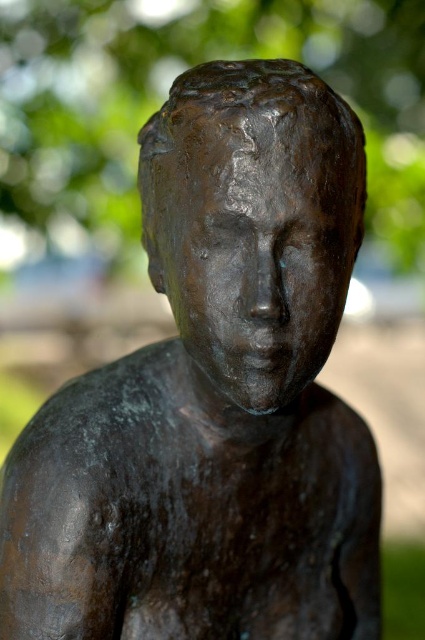
Question: In this image, where is green matte tree at center located relative to bronze statue at center?

Choices:
 (A) left
 (B) right

Answer: (A)

Question: Which point is closer to the camera taking this photo?

Choices:
 (A) (85, 96)
 (B) (167, 205)

Answer: (B)

Question: Which point is closer to the camera?

Choices:
 (A) green matte tree at center
 (B) bronze statue at center

Answer: (B)

Question: Can you confirm if green matte tree at center is thinner than bronze statue at center?

Choices:
 (A) no
 (B) yes

Answer: (A)

Question: Considering the relative positions of green matte tree at center and bronze statue at center in the image provided, where is green matte tree at center located with respect to bronze statue at center?

Choices:
 (A) left
 (B) right

Answer: (A)